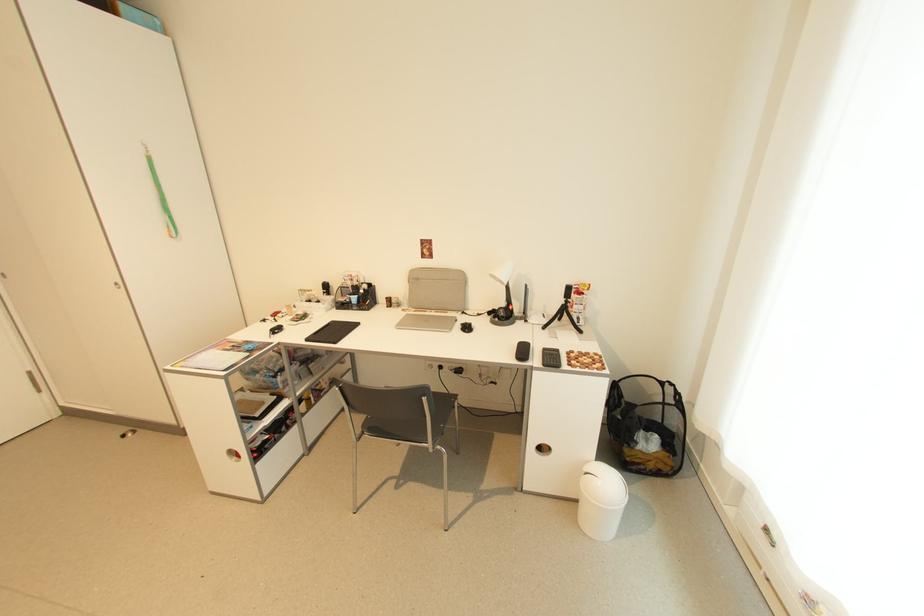
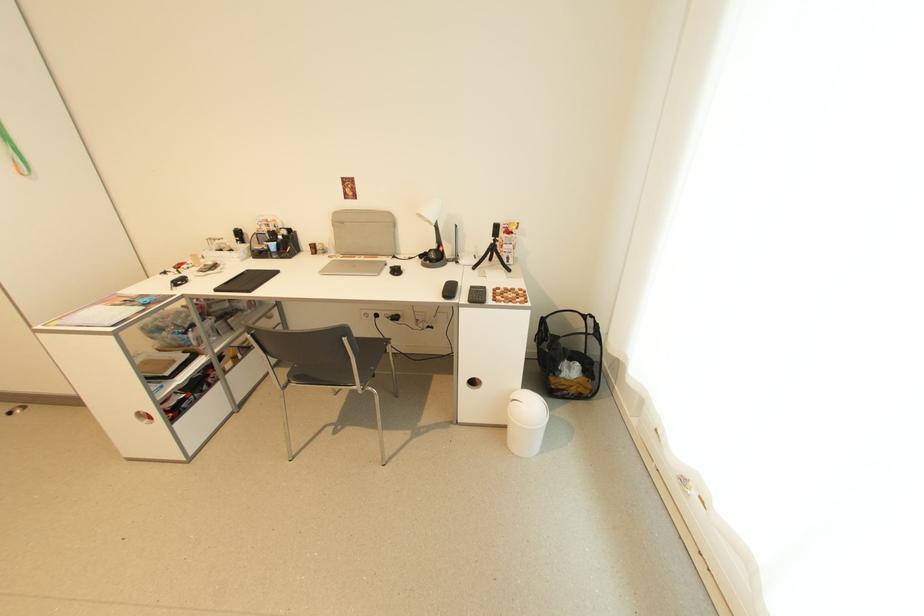
Locate, in the second image, the point that corresponds to pixel 548 367 in the first image.

(473, 302)